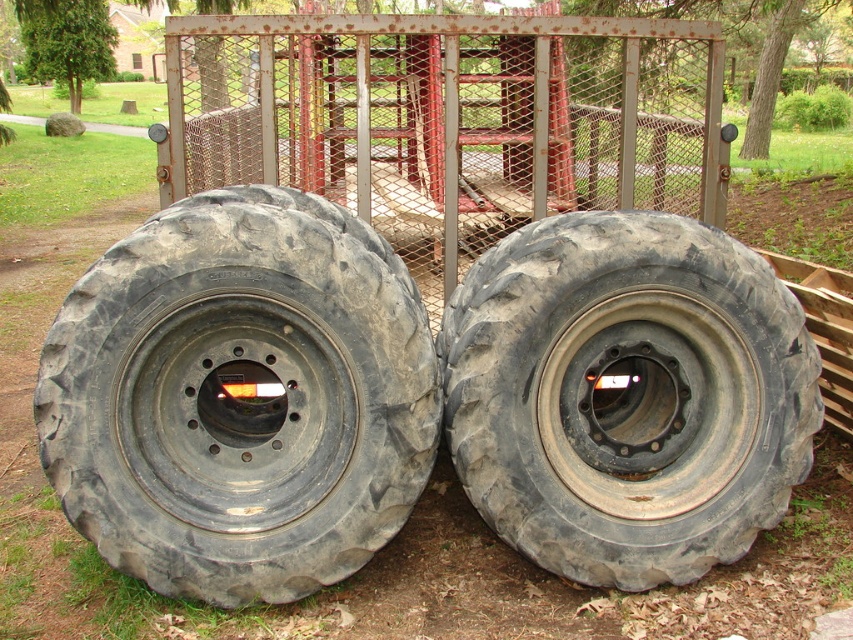
Question: Is black rubber tire at left to the left of black rubber tire at center from the viewer's perspective?

Choices:
 (A) yes
 (B) no

Answer: (A)

Question: Which point is farther to the camera?

Choices:
 (A) black rubber tire at center
 (B) black rubber tire at left

Answer: (A)

Question: Does black rubber tire at left have a smaller size compared to black rubber tire at center?

Choices:
 (A) yes
 (B) no

Answer: (B)

Question: Does black rubber tire at left have a greater width compared to black rubber tire at center?

Choices:
 (A) yes
 (B) no

Answer: (B)